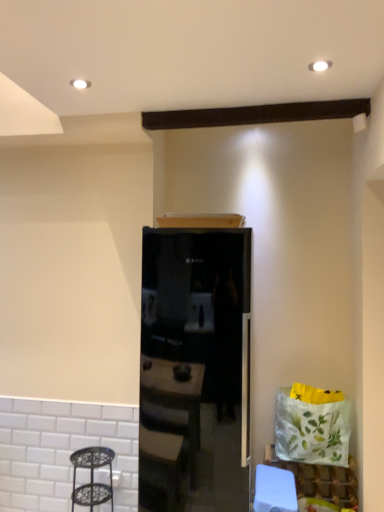
Question: From a real-world perspective, is black glass refrigerator at center positioned under white paper bag at lower right based on gravity?

Choices:
 (A) no
 (B) yes

Answer: (A)

Question: Considering the relative sizes of black glass refrigerator at center and white paper bag at lower right in the image provided, is black glass refrigerator at center shorter than white paper bag at lower right?

Choices:
 (A) yes
 (B) no

Answer: (B)

Question: From a real-world perspective, does black glass refrigerator at center stand above white paper bag at lower right?

Choices:
 (A) yes
 (B) no

Answer: (A)

Question: Would you say black glass refrigerator at center contains white paper bag at lower right?

Choices:
 (A) no
 (B) yes

Answer: (A)

Question: Is black glass refrigerator at center facing away from white paper bag at lower right?

Choices:
 (A) no
 (B) yes

Answer: (A)

Question: Based on their positions, is black glass refrigerator at center located to the left or right of metallic black step stool at lower left?

Choices:
 (A) right
 (B) left

Answer: (A)

Question: Is black glass refrigerator at center in front of or behind metallic black step stool at lower left in the image?

Choices:
 (A) behind
 (B) front

Answer: (B)

Question: Is black glass refrigerator at center taller or shorter than metallic black step stool at lower left?

Choices:
 (A) short
 (B) tall

Answer: (B)

Question: Considering the positions of black glass refrigerator at center and metallic black step stool at lower left in the image, is black glass refrigerator at center bigger or smaller than metallic black step stool at lower left?

Choices:
 (A) big
 (B) small

Answer: (A)

Question: Does point (94, 456) appear closer or farther from the camera than point (200, 264)?

Choices:
 (A) closer
 (B) farther

Answer: (B)

Question: Is metallic black step stool at lower left in front of or behind black glass refrigerator at center in the image?

Choices:
 (A) behind
 (B) front

Answer: (A)

Question: Visually, is metallic black step stool at lower left positioned to the left or to the right of black glass refrigerator at center?

Choices:
 (A) left
 (B) right

Answer: (A)

Question: Is metallic black step stool at lower left inside the boundaries of black glass refrigerator at center, or outside?

Choices:
 (A) outside
 (B) inside

Answer: (A)

Question: In terms of height, does black glass refrigerator at center look taller or shorter compared to white paper bag at lower right?

Choices:
 (A) short
 (B) tall

Answer: (B)

Question: Is black glass refrigerator at center situated inside white paper bag at lower right or outside?

Choices:
 (A) outside
 (B) inside

Answer: (A)